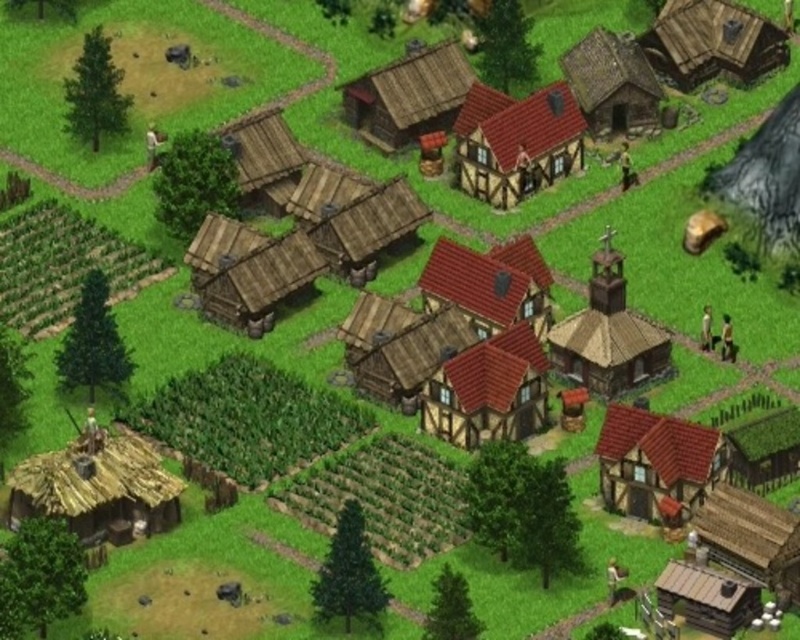
Question: Which object is farther from the camera taking this photo?

Choices:
 (A) wooden thatched hut at upper right
 (B) green thatched roof hut at lower right

Answer: (A)

Question: Which point appears closest to the camera in this image?

Choices:
 (A) (760, 448)
 (B) (504, 118)
 (C) (72, 468)
 (D) (646, 358)

Answer: (C)

Question: Does brown wooden church at center have a greater width compared to wooden thatched hut at lower right?

Choices:
 (A) yes
 (B) no

Answer: (A)

Question: Does wooden planks house at center have a greater width compared to rustic wooden hut at upper right?

Choices:
 (A) no
 (B) yes

Answer: (B)

Question: Among these objects, which one is nearest to the camera?

Choices:
 (A) brown wooden church at center
 (B) wooden thatched hut at lower right

Answer: (B)

Question: Is matte brown wooden hut at lower right below wooden thatched hut at center?

Choices:
 (A) no
 (B) yes

Answer: (B)